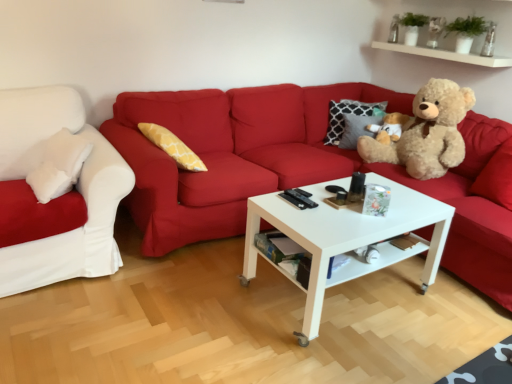
Question: Is matte red couch at center, which is counted as the first studio couch, starting from the right, inside or outside of light brown plush teddy bear at right?

Choices:
 (A) inside
 (B) outside

Answer: (B)

Question: From a real-world perspective, is matte red couch at center, the 2th studio couch viewed from the left, physically located above or below light brown plush teddy bear at right?

Choices:
 (A) below
 (B) above

Answer: (A)

Question: Considering the real-world distances, which object is closest to the matte red couch at center, the 2th studio couch viewed from the left?

Choices:
 (A) white glossy coffee table at center
 (B) light brown plush teddy bear at right
 (C) white soft cushion at left, marked as the 1th studio couch in a left-to-right arrangement
 (D) white glossy shelf at upper right

Answer: (B)

Question: Estimate the real-world distances between objects in this image. Which object is farther from the white glossy coffee table at center?

Choices:
 (A) white soft cushion at left, which is counted as the second studio couch, starting from the right
 (B) white glossy shelf at upper right
 (C) matte red couch at center, the 2th studio couch viewed from the left
 (D) light brown plush teddy bear at right

Answer: (B)